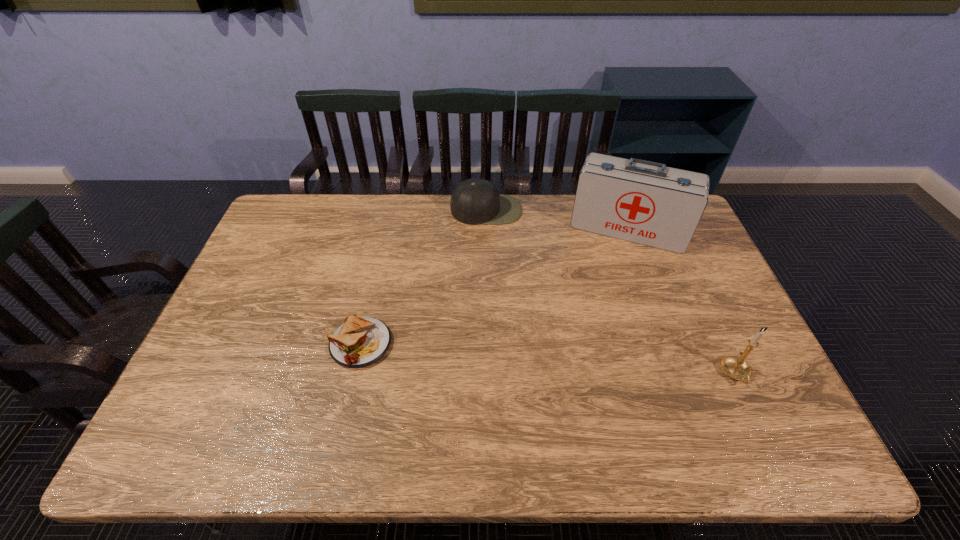
Image resolution: width=960 pixels, height=540 pixels. I want to click on object located at the near right corner, so click(x=736, y=367).

In the image, there is a desktop. What are the coordinates of `vacant space at the far edge` in the screenshot? It's located at (361, 230).

Locate an element on the screen. This screenshot has height=540, width=960. vacant space at the near edge of the desktop is located at coordinates (326, 392).

The height and width of the screenshot is (540, 960). I want to click on vacant position at the left edge of the desktop, so click(217, 369).

The image size is (960, 540). What are the coordinates of `vacant space at the far left corner` in the screenshot? It's located at (297, 204).

Where is `free space between the third shortest object and the second object from left to right`? The image size is (960, 540). free space between the third shortest object and the second object from left to right is located at coordinates pyautogui.click(x=611, y=292).

I want to click on vacant area that lies between the third tallest object and the first-aid kit, so click(557, 220).

Locate an element on the screen. This screenshot has width=960, height=540. blank region between the second shortest object and the first-aid kit is located at coordinates (557, 220).

Where is `free space between the leftmost object and the candle holder`? This screenshot has height=540, width=960. free space between the leftmost object and the candle holder is located at coordinates (548, 359).

At what (x,y) coordinates should I click in order to perform the action: click on vacant space in between the third tallest object and the candle holder. Please return your answer as a coordinate pair (x, y). Looking at the image, I should click on (611, 292).